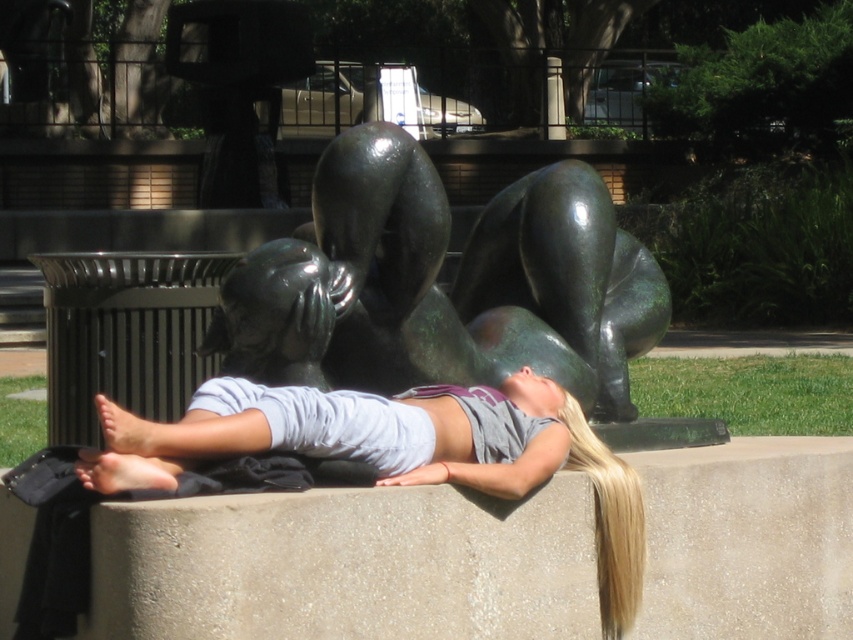
Is green patina sculpture at center above gray cotton shirt at center?

Correct, green patina sculpture at center is located above gray cotton shirt at center.

Does green patina sculpture at center lie in front of gray cotton shirt at center?

No, green patina sculpture at center is further to the viewer.

Is point (549, 284) closer to camera compared to point (432, 449)?

No, it is not.

What are the coordinates of `green patina sculpture at center` in the screenshot? It's located at (438, 285).